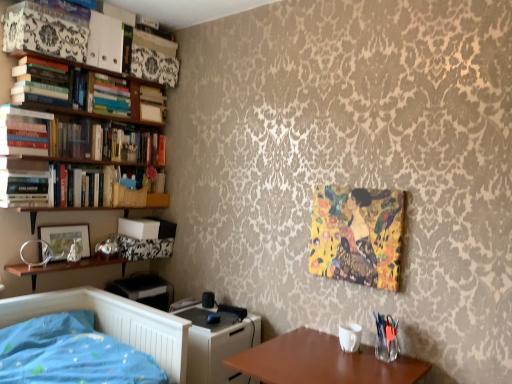
Question: Is hardcover book at left, which appears as the first book when ordered from the bottom, placed right next to hardcover books at upper left, the 6th book when ordered from bottom to top?

Choices:
 (A) no
 (B) yes

Answer: (A)

Question: Is hardcover book at left, which appears as the first book when ordered from the bottom, bigger than hardcover books at upper left, which ranks as the 1th book in top-to-bottom order?

Choices:
 (A) yes
 (B) no

Answer: (B)

Question: Would you say hardcover book at left, the sixth book positioned from the top, is outside hardcover books at upper left, which ranks as the 1th book in top-to-bottom order?

Choices:
 (A) yes
 (B) no

Answer: (A)

Question: From a real-world perspective, is hardcover book at left, which appears as the first book when ordered from the bottom, positioned under hardcover books at upper left, the 6th book when ordered from bottom to top, based on gravity?

Choices:
 (A) yes
 (B) no

Answer: (A)

Question: From a real-world perspective, is hardcover book at left, the sixth book positioned from the top, positioned over hardcover books at upper left, which ranks as the 1th book in top-to-bottom order, based on gravity?

Choices:
 (A) no
 (B) yes

Answer: (A)

Question: Considering the positions of hardcover books at left, which is counted as the 3th book, starting from the bottom, and hardcover books at left, marked as the fifth book in a bottom-to-top arrangement, in the image, is hardcover books at left, which is counted as the 3th book, starting from the bottom, taller or shorter than hardcover books at left, marked as the fifth book in a bottom-to-top arrangement,?

Choices:
 (A) tall
 (B) short

Answer: (A)

Question: Is hardcover books at left, which is counted as the 3th book, starting from the bottom, inside the boundaries of hardcover books at left, marked as the fifth book in a bottom-to-top arrangement, or outside?

Choices:
 (A) inside
 (B) outside

Answer: (B)

Question: Considering the positions of point (4, 145) and point (54, 97), is point (4, 145) closer or farther from the camera than point (54, 97)?

Choices:
 (A) closer
 (B) farther

Answer: (A)

Question: Considering the positions of hardcover books at left, which is counted as the 3th book, starting from the bottom, and hardcover books at left, marked as the fifth book in a bottom-to-top arrangement, in the image, is hardcover books at left, which is counted as the 3th book, starting from the bottom, bigger or smaller than hardcover books at left, marked as the fifth book in a bottom-to-top arrangement,?

Choices:
 (A) big
 (B) small

Answer: (B)

Question: Looking at their shapes, would you say hardcover books at left, which is the 2th book in bottom-to-top order, is wider or thinner than metallic silver picture frame at left?

Choices:
 (A) wide
 (B) thin

Answer: (A)

Question: In the image, is hardcover books at left, placed as the 5th book when sorted from top to bottom, positioned in front of or behind metallic silver picture frame at left?

Choices:
 (A) front
 (B) behind

Answer: (A)

Question: From a real-world perspective, is hardcover books at left, which is the 2th book in bottom-to-top order, above or below metallic silver picture frame at left?

Choices:
 (A) below
 (B) above

Answer: (B)

Question: Is hardcover books at left, which is the 2th book in bottom-to-top order, bigger or smaller than metallic silver picture frame at left?

Choices:
 (A) big
 (B) small

Answer: (A)

Question: Is hardcover books at left, which is the 2th book in bottom-to-top order, taller or shorter than hardcover books at upper left, which is the fourth book from bottom to top?

Choices:
 (A) tall
 (B) short

Answer: (B)

Question: Is point (70, 129) closer or farther from the camera than point (91, 96)?

Choices:
 (A) farther
 (B) closer

Answer: (B)